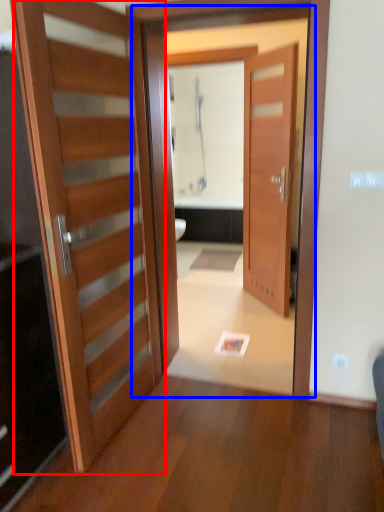
Question: Which object is further to the camera taking this photo, door (highlighted by a red box) or screen door (highlighted by a blue box)?

Choices:
 (A) door
 (B) screen door

Answer: (B)